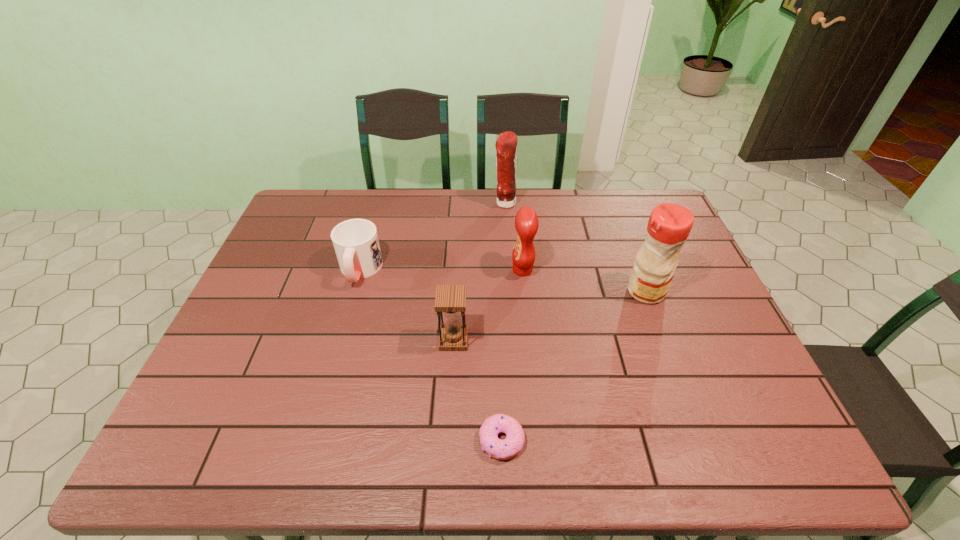
Where is `free spot between the farthest object and the fourth shortest object`? The height and width of the screenshot is (540, 960). free spot between the farthest object and the fourth shortest object is located at coordinates (514, 237).

I want to click on free point between the fourth tallest object and the farthest condiment, so click(479, 272).

I want to click on free space between the mug and the farthest object, so pos(432,237).

The image size is (960, 540). I want to click on unoccupied area between the doughnut and the rightmost object, so click(x=574, y=366).

Image resolution: width=960 pixels, height=540 pixels. Find the location of `vacant space that is in between the farthest condiment and the shortest object`. vacant space that is in between the farthest condiment and the shortest object is located at coordinates tap(503, 322).

Locate which object ranks third in proximity to the shortest object. Please provide its 2D coordinates. Your answer should be formatted as a tuple, i.e. [(x, y)], where the tuple contains the x and y coordinates of a point satisfying the conditions above.

[(669, 225)]

Where is `the fourth closest object to the farthest object`? the fourth closest object to the farthest object is located at coordinates (450, 299).

The image size is (960, 540). In order to click on condiment object that ranks as the closest to the farthest object in this screenshot , I will do `click(526, 221)`.

In order to click on condiment identified as the closest to the third tallest object in this screenshot , I will do `click(506, 145)`.

Find the location of a particular element. vacant position in the image that satisfies the following two spatial constraints: 1. on the label side of the third tallest object; 2. on the side of the fifth tallest object with the handle is located at coordinates (522, 271).